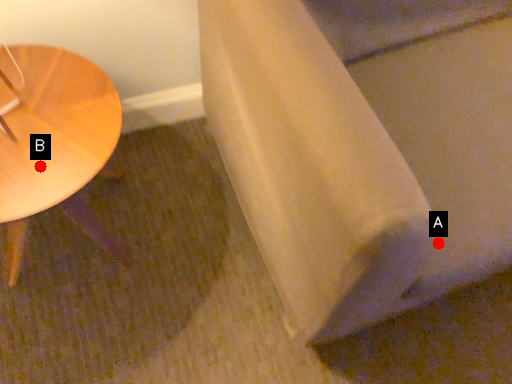
Question: Two points are circled on the image, labeled by A and B beside each circle. Which point appears farthest from the camera in this image?

Choices:
 (A) A is further
 (B) B is further

Answer: (A)